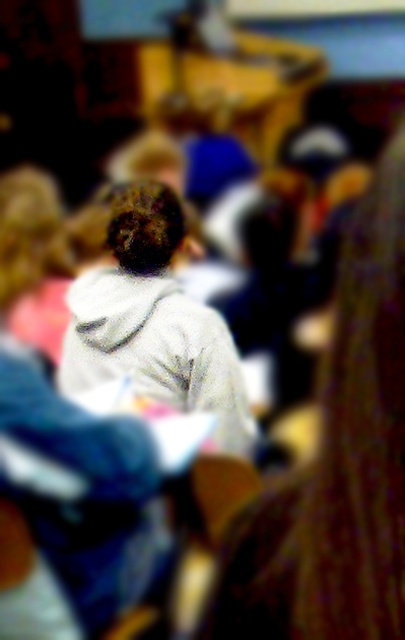
Find the location of a particular element. Image resolution: width=405 pixels, height=640 pixels. white fleece hoodie at center is located at coordinates (338, 465).

Does point (328, 637) come farther from viewer compared to point (136, 320)?

No.

Where is `white fleece hoodie at center`? The width and height of the screenshot is (405, 640). white fleece hoodie at center is located at coordinates (338, 465).